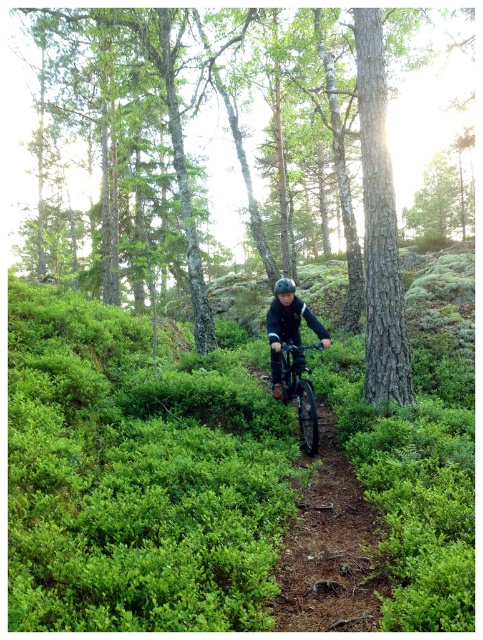
Can you confirm if matte black helmet at center is bigger than metallic matte bicycle at center?

Correct, matte black helmet at center is larger in size than metallic matte bicycle at center.

Does matte black helmet at center appear on the right side of metallic matte bicycle at center?

In fact, matte black helmet at center is to the left of metallic matte bicycle at center.

Which is behind, point (288, 333) or point (281, 348)?

Point (288, 333)

What are the coordinates of `matte black helmet at center` in the screenshot? It's located at (287, 326).

Is rough bark tree at center below black matte helmet at center?

No, rough bark tree at center is not below black matte helmet at center.

Which is more to the right, rough bark tree at center or black matte helmet at center?

Positioned to the right is rough bark tree at center.

Is point (27, 195) closer to viewer compared to point (274, 291)?

No, (27, 195) is further to viewer.

Locate an element on the screen. rough bark tree at center is located at coordinates (423, 120).

Does point (395, 170) lie behind point (278, 362)?

Yes, point (395, 170) is behind point (278, 362).

Is point (472, 80) positioned after point (287, 282)?

Yes, it is behind point (287, 282).

Identify the location of rough bark tree at center. (423, 120).